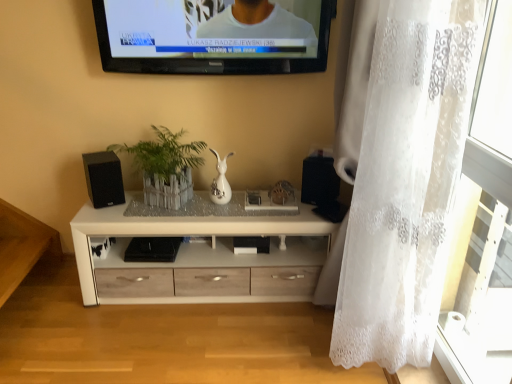
Question: Visually, is white wood chest of drawers at center positioned to the left or to the right of white lace curtain at right?

Choices:
 (A) left
 (B) right

Answer: (A)

Question: Considering the positions of white wood chest of drawers at center and white lace curtain at right in the image, is white wood chest of drawers at center taller or shorter than white lace curtain at right?

Choices:
 (A) short
 (B) tall

Answer: (A)

Question: Which is nearer to the black matte speaker at left, the first speaker positioned from the left?

Choices:
 (A) white wood chest of drawers at center
 (B) transparent glass door at right
 (C) black glossy television at upper center
 (D) green leafy plant at center
 (E) black matte speaker at right, placed as the second speaker when sorted from left to right

Answer: (D)

Question: Which object is the farthest from the black matte speaker at right, acting as the 1th speaker starting from the right?

Choices:
 (A) white lace curtain at right
 (B) black glossy television at upper center
 (C) green leafy plant at center
 (D) black matte speaker at left, the first speaker positioned from the left
 (E) white wood chest of drawers at center

Answer: (D)